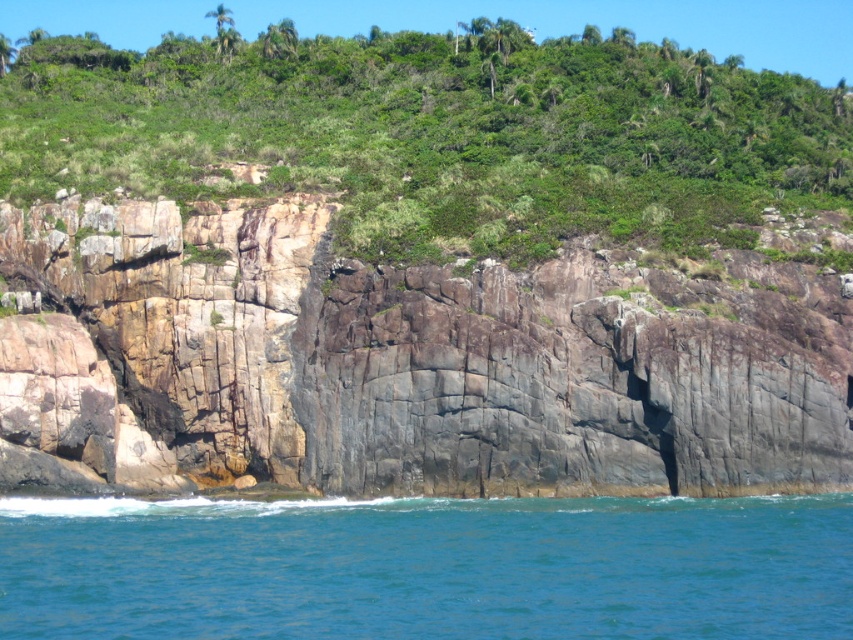
Does green leafy vegetation at upper center appear on the right side of blue water at lower left?

Incorrect, green leafy vegetation at upper center is not on the right side of blue water at lower left.

Is point (640, 76) positioned in front of point (766, 618)?

No, it is not.

Is point (601, 108) behind point (682, 557)?

Yes, it is behind point (682, 557).

Locate an element on the screen. Image resolution: width=853 pixels, height=640 pixels. green leafy vegetation at upper center is located at coordinates (433, 132).

Which of these two, gray/rocky cliff at center or green leafy vegetation at upper center, stands shorter?

Standing shorter between the two is gray/rocky cliff at center.

Is gray/rocky cliff at center positioned behind green leafy vegetation at upper center?

No, gray/rocky cliff at center is closer to the viewer.

Measure the distance between gray/rocky cliff at center and camera.

gray/rocky cliff at center is 76.46 meters away from camera.

The image size is (853, 640). What are the coordinates of `gray/rocky cliff at center` in the screenshot? It's located at (409, 362).

In the scene shown: Is gray/rocky cliff at center smaller than blue water at lower left?

No, gray/rocky cliff at center is not smaller than blue water at lower left.

From the picture: Who is more forward, (x=606, y=385) or (x=45, y=608)?

Point (x=45, y=608)

Is point (728, 467) positioned before point (358, 508)?

No, it is behind (358, 508).

Where is `gray/rocky cliff at center`? The width and height of the screenshot is (853, 640). gray/rocky cliff at center is located at coordinates (409, 362).